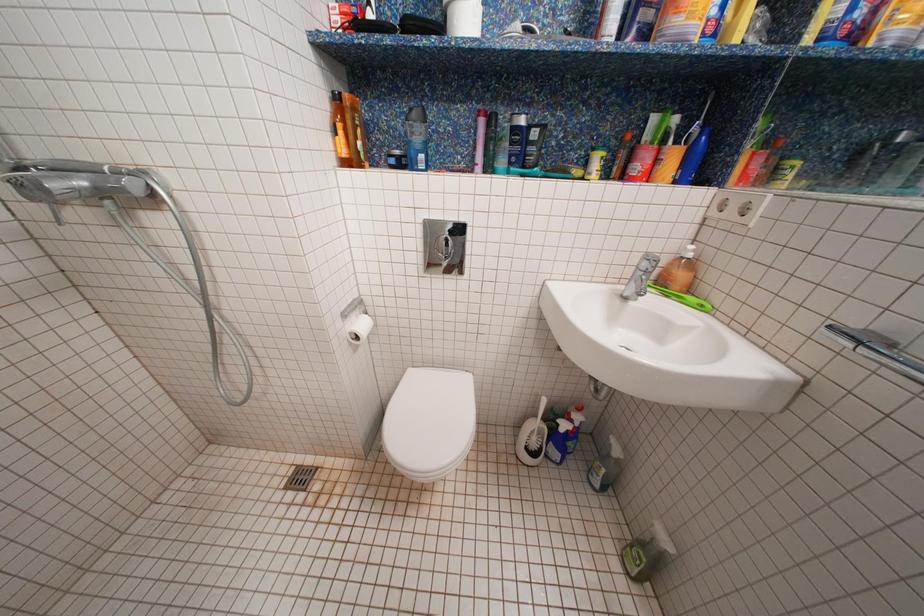
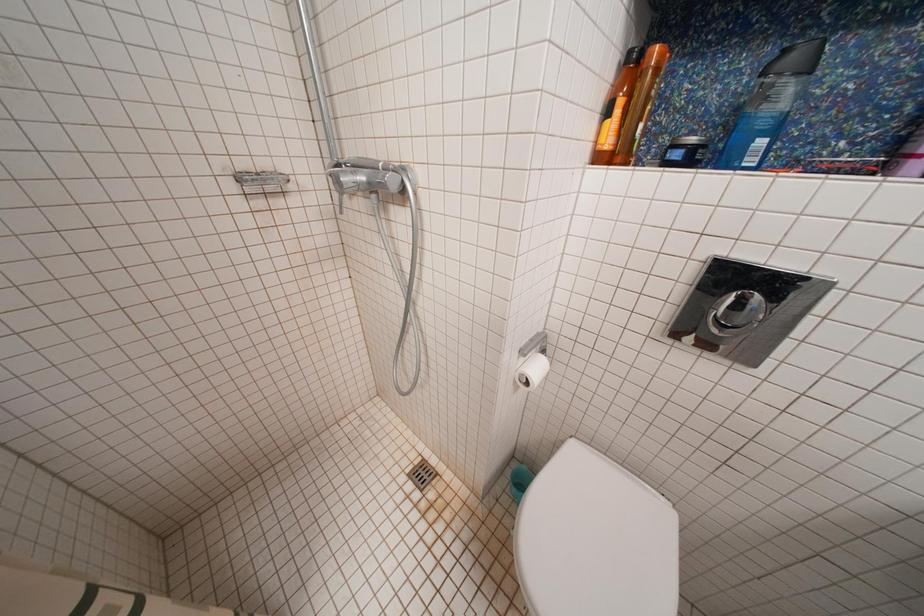
Question: Based on the continuous images, in which direction is the camera rotating? Reply with the corresponding letter.

Choices:
 (A) Left
 (B) Right
 (C) Up
 (D) Down

Answer: (A)